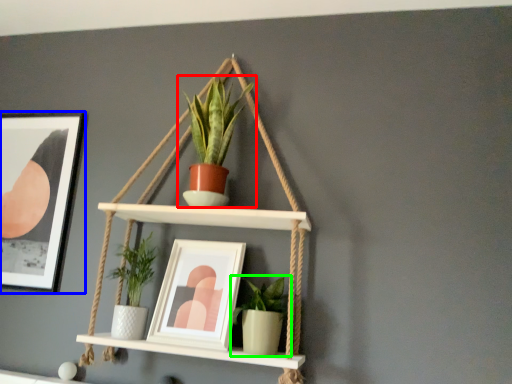
Question: Estimate the real-world distances between objects in this image. Which object is farther from houseplant (highlighted by a red box), picture frame (highlighted by a blue box) or houseplant (highlighted by a green box)?

Choices:
 (A) picture frame
 (B) houseplant

Answer: (A)